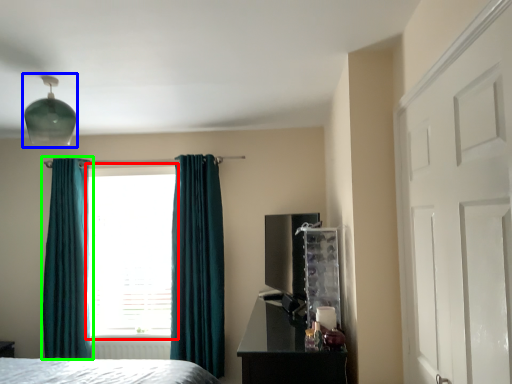
Question: Considering the real-world distances, which object is closest to window (highlighted by a red box)? light fixture (highlighted by a blue box) or curtain (highlighted by a green box).

Choices:
 (A) light fixture
 (B) curtain

Answer: (B)